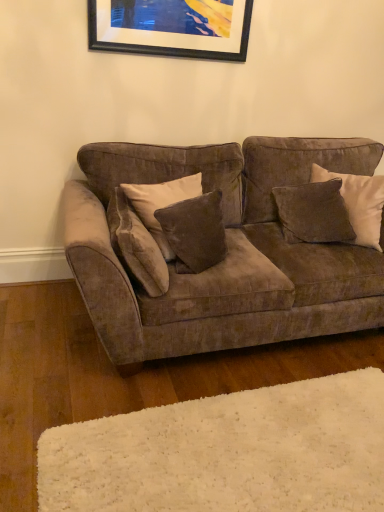
At what (x,y) coordinates should I click in order to perform the action: click on empty space that is ontop of white shag rug at lower center (from a real-world perspective). Please return your answer as a coordinate pair (x, y). Image resolution: width=384 pixels, height=512 pixels. Looking at the image, I should click on (256, 443).